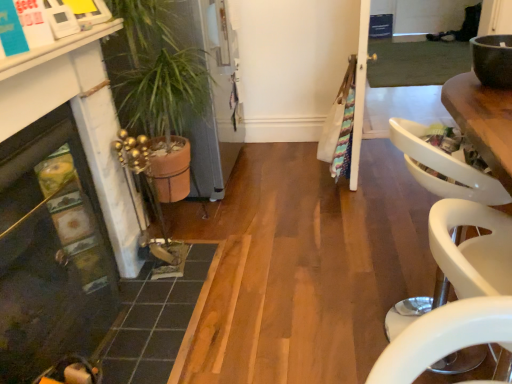
Question: Can you confirm if matte black fireplace at lower left is bigger than matte brown bowl at upper right?

Choices:
 (A) yes
 (B) no

Answer: (A)

Question: Is matte black fireplace at lower left to the right of matte brown bowl at upper right from the viewer's perspective?

Choices:
 (A) no
 (B) yes

Answer: (A)

Question: Would you consider matte black fireplace at lower left to be distant from matte brown bowl at upper right?

Choices:
 (A) no
 (B) yes

Answer: (B)

Question: Does matte black fireplace at lower left contain matte brown bowl at upper right?

Choices:
 (A) yes
 (B) no

Answer: (B)

Question: Is matte black fireplace at lower left positioned with its back to matte brown bowl at upper right?

Choices:
 (A) yes
 (B) no

Answer: (B)

Question: From the image's perspective, is matte brown bowl at upper right positioned above or below dark gray tile at lower left?

Choices:
 (A) above
 (B) below

Answer: (A)

Question: In the image, is matte brown bowl at upper right positioned in front of or behind dark gray tile at lower left?

Choices:
 (A) front
 (B) behind

Answer: (A)

Question: Is matte brown bowl at upper right to the left or to the right of dark gray tile at lower left in the image?

Choices:
 (A) left
 (B) right

Answer: (B)

Question: From a real-world perspective, is matte brown bowl at upper right above or below dark gray tile at lower left?

Choices:
 (A) above
 (B) below

Answer: (A)

Question: From the image's perspective, is dark gray tile at lower left above or below matte brown bowl at upper right?

Choices:
 (A) above
 (B) below

Answer: (B)

Question: Based on their positions, is dark gray tile at lower left located to the left or right of matte brown bowl at upper right?

Choices:
 (A) left
 (B) right

Answer: (A)

Question: Is dark gray tile at lower left spatially inside matte brown bowl at upper right, or outside of it?

Choices:
 (A) outside
 (B) inside

Answer: (A)

Question: Does point (184, 264) appear closer or farther from the camera than point (484, 39)?

Choices:
 (A) farther
 (B) closer

Answer: (A)

Question: Would you say matte brown bowl at upper right is to the left or to the right of terracotta pot at left in the picture?

Choices:
 (A) left
 (B) right

Answer: (B)

Question: Does point coord(487,67) appear closer or farther from the camera than point coord(133,102)?

Choices:
 (A) farther
 (B) closer

Answer: (B)